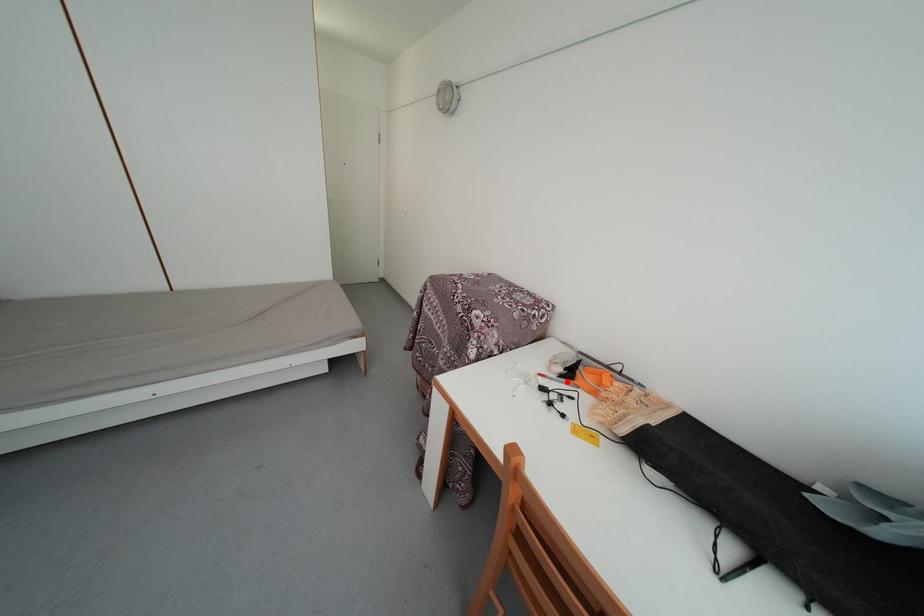
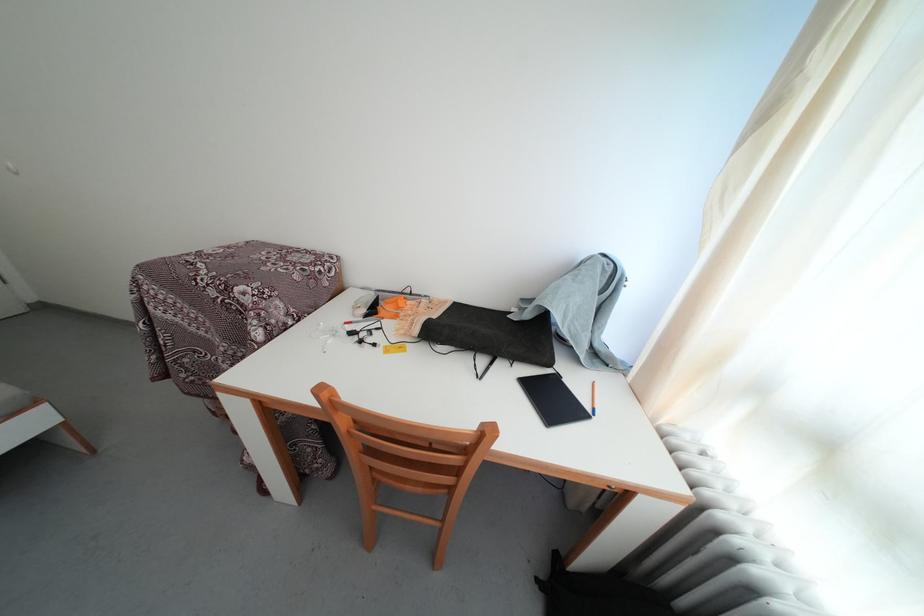
Locate, in the second image, the point that corresponds to the highlighted location in the first image.

(371, 322)